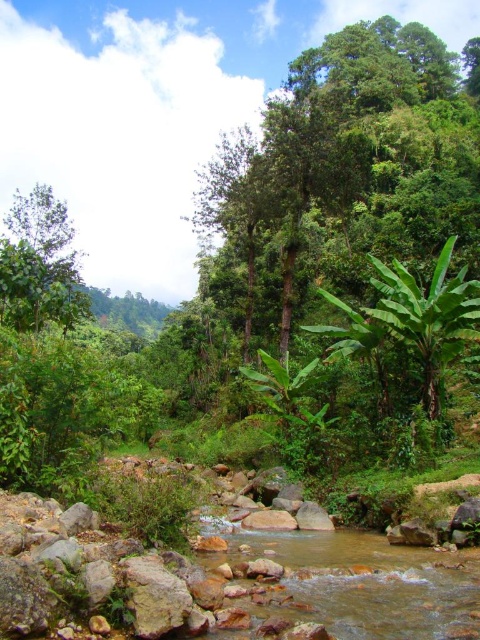
Question: Which point is closer to the camera?

Choices:
 (A) (x=47, y=292)
 (B) (x=417, y=154)

Answer: (A)

Question: Which point is closer to the camera?

Choices:
 (A) green leafy tree at center
 (B) green leafy tree at left

Answer: (B)

Question: From the image, what is the correct spatial relationship of green leafy tree at center in relation to green leafy tree at left?

Choices:
 (A) right
 (B) left

Answer: (A)

Question: Is green leafy tree at center thinner than green leafy tree at left?

Choices:
 (A) yes
 (B) no

Answer: (B)

Question: Is green leafy tree at center above green leafy tree at left?

Choices:
 (A) yes
 (B) no

Answer: (A)